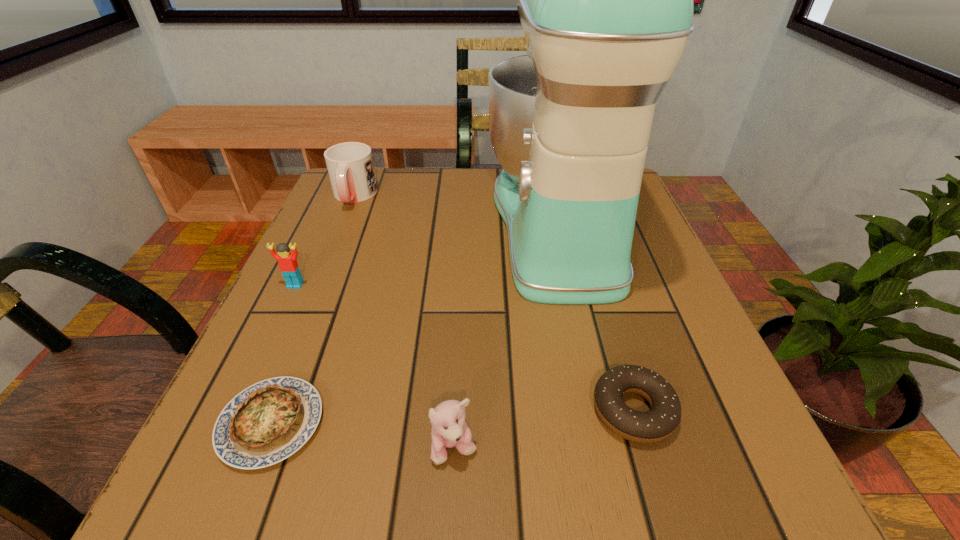
Locate an element on the screen. the tallest object is located at coordinates (605, 0).

The width and height of the screenshot is (960, 540). I want to click on mug, so click(350, 166).

Where is `Lego`? Lego is located at coordinates (288, 265).

You are a GUI agent. You are given a task and a screenshot of the screen. Output one action in this format:
    pyautogui.click(x=<x>, y=<y>)
    Task: Click on the fourth object from left to right
    The width and height of the screenshot is (960, 540).
    Given the screenshot: What is the action you would take?
    pyautogui.click(x=449, y=430)

At what (x,y) coordinates should I click in order to perform the action: click on the fifth tallest object. Please return your answer as a coordinate pair (x, y). The image size is (960, 540). Looking at the image, I should click on (658, 423).

At what (x,y) coordinates should I click in order to perform the action: click on quiche. Please return your answer as a coordinate pair (x, y). This screenshot has width=960, height=540. Looking at the image, I should click on (269, 421).

This screenshot has height=540, width=960. I want to click on vacant area located 0.160m at the base of the tallest object, so click(416, 225).

Locate an element on the screen. The image size is (960, 540). free space located at the base of the tallest object is located at coordinates (452, 225).

Identify the location of vacant area situated 0.180m at the base of the tallest object. Image resolution: width=960 pixels, height=540 pixels. (406, 225).

Locate an element on the screen. free space located 0.290m on the side of the mug with the handle is located at coordinates (310, 301).